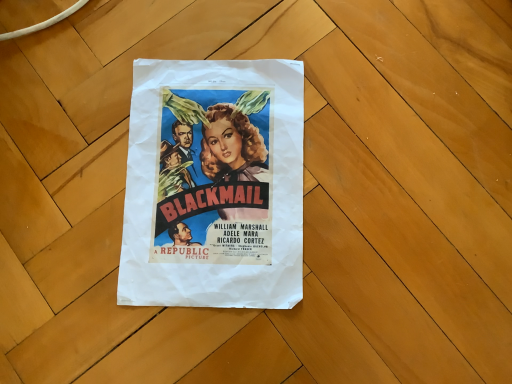
Identify the location of matte paper poster at center. pyautogui.click(x=214, y=185).

Measure the distance between matte paper poster at center and camera.

The depth of matte paper poster at center is 18.66 inches.

The height and width of the screenshot is (384, 512). Describe the element at coordinates (214, 185) in the screenshot. I see `matte paper poster at center` at that location.

The image size is (512, 384). What are the coordinates of `matte paper poster at center` in the screenshot? It's located at (214, 185).